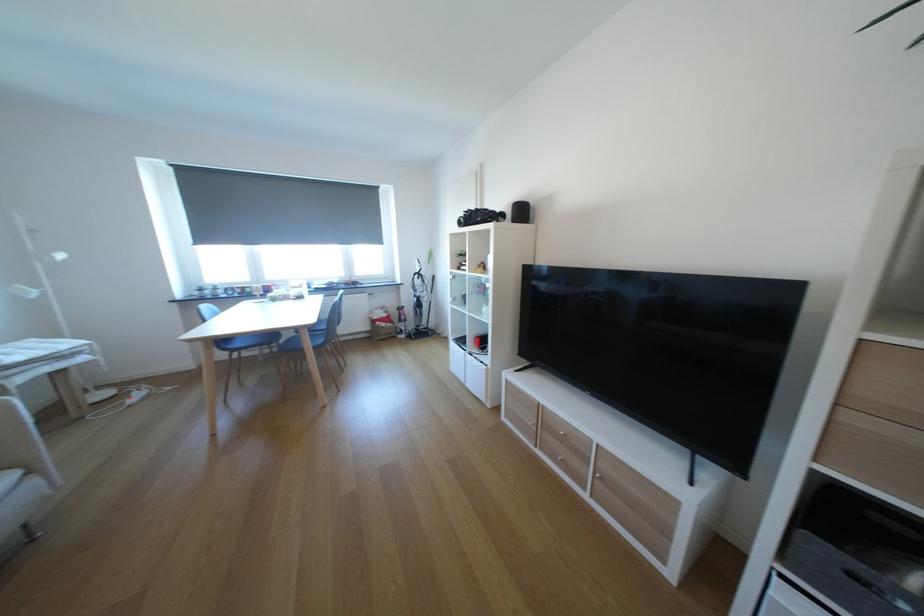
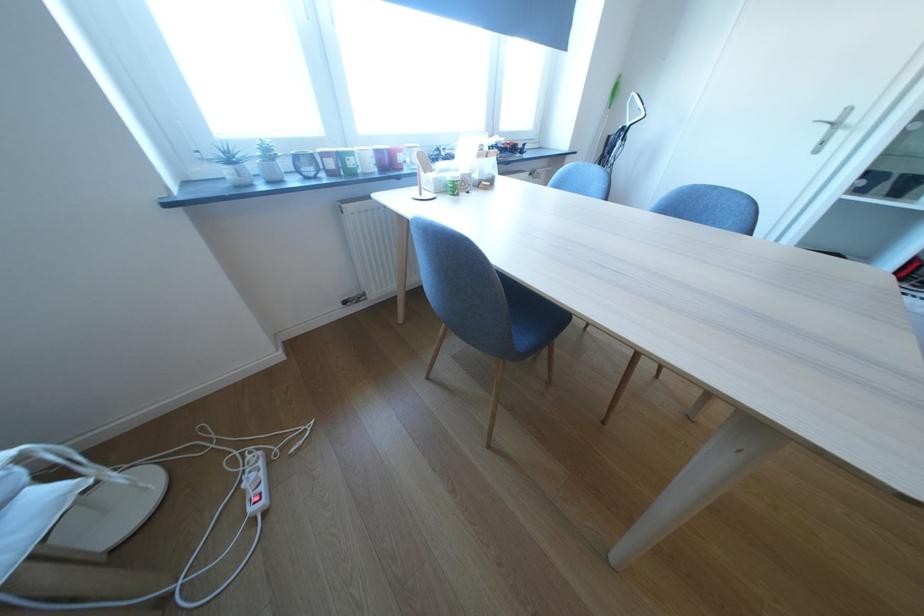
What movement of the cameraman would produce the second image?

The movement direction of the cameraman is left, forward.